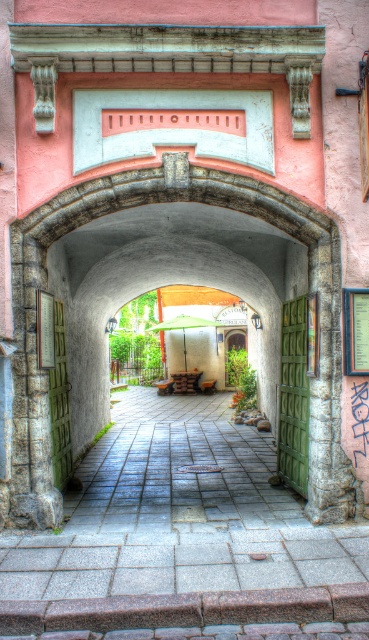
You are standing in front of the stone archway and want to enter through the green wooden door at center located at point (294, 396). Can you walk directly to that point without any obstacles?

Yes, you can walk directly to point (294, 396) where the green wooden door at center is located because there are no objects mentioned in the scene description that would block the path.

You are a delivery person trying to navigate through the courtyard. The granite paved path at center and the green matte door at left are both in your way. Which one do you need to go around because it is larger?

The granite paved path at center is bigger than the green matte door at left, so you need to go around the granite paved path at center.